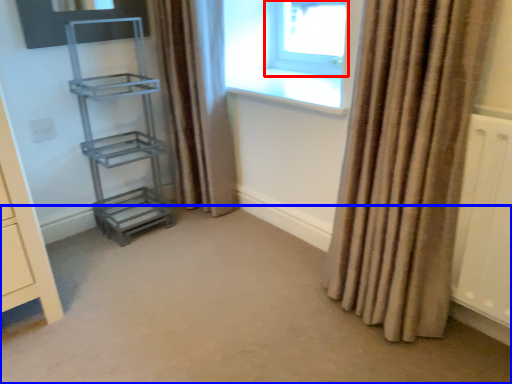
Question: Which of the following is the farthest to the observer, window (highlighted by a red box) or plain (highlighted by a blue box)?

Choices:
 (A) window
 (B) plain

Answer: (A)